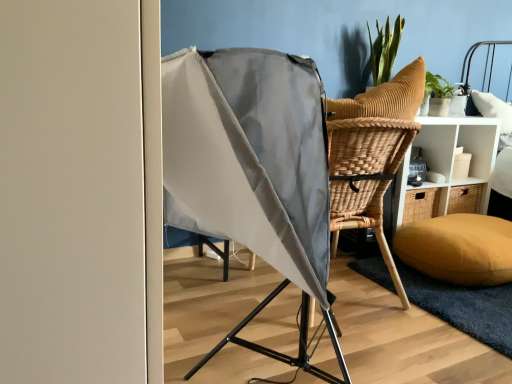
Question: Looking at the image, does mustard yellow fabric pillow at lower right seem bigger or smaller compared to brown wicker chair at center right?

Choices:
 (A) small
 (B) big

Answer: (A)

Question: Is mustard yellow fabric pillow at lower right to the left or to the right of brown wicker chair at center right in the image?

Choices:
 (A) right
 (B) left

Answer: (A)

Question: Considering the real-world distances, which object is closest to the brown wicker chair at center right?

Choices:
 (A) mustard yellow fabric pillow at lower right
 (B) soft yellow mat at lower right

Answer: (A)

Question: Which of these objects is positioned closest to the mustard yellow fabric pillow at lower right?

Choices:
 (A) brown wicker chair at center right
 (B) soft yellow mat at lower right

Answer: (B)